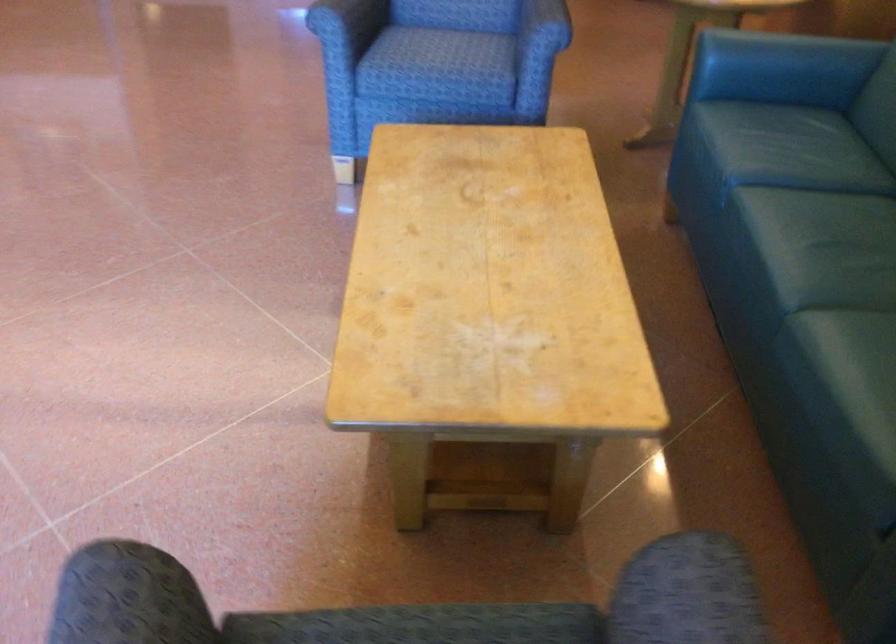
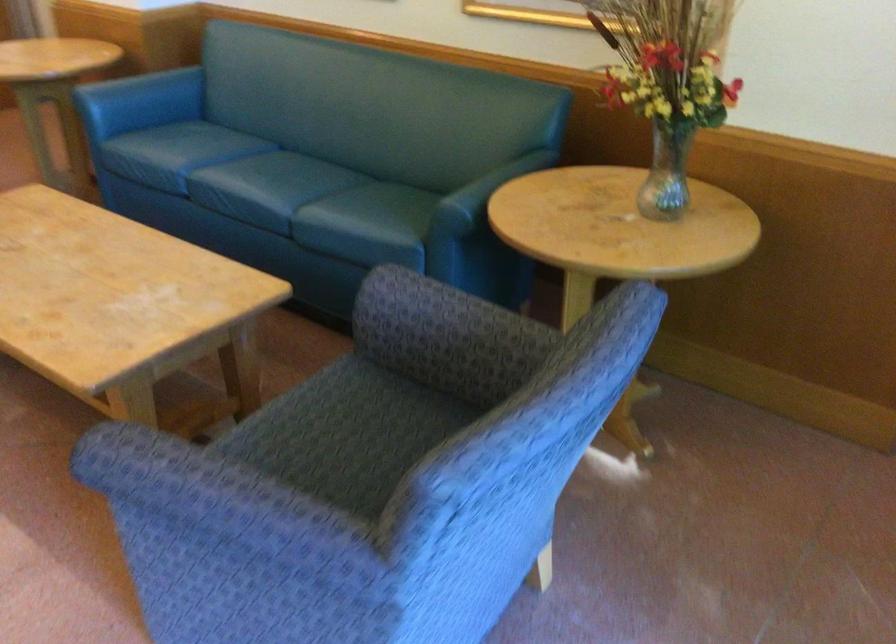
Where in the second image is the point corresponding to (x=757, y=69) from the first image?

(140, 102)